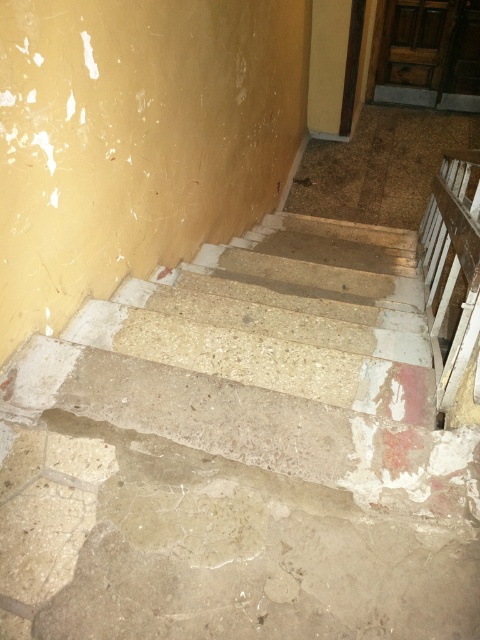
You are standing at the bottom of the worn staircase and want to reach the top. There are two points marked on the steps. One is at point (90, 381) and the other at point (462, 198). Which point should you step on first to start climbing the stairs?

You should step on point (90, 381) first because it is closer to you than point (462, 198), which is further away.

You are a delivery person carrying a large box that is 20 inches wide. You need to walk up the concrete stairs at center while avoiding the white wooden rail at right. Can you safely pass through the space between them?

The distance between the concrete stairs at center and the white wooden rail at right is 20.19 inches. Since your box is 20 inches wide, there is enough space to pass safely with a small margin of 0.19 inches.

You are a delivery person carrying a large box that is 2 meters wide. You need to navigate through the staircase area shown in the image. Can you pass through the space between the concrete stairs at center and the white wooden rail at right? Please explain your reasoning.

The concrete stairs at center might be wider than the white wooden rail at right. However, since the box is 2 meters wide and the exact width of the space between them isn not specified, it is uncertain whether the box will fit. You should measure the space before attempting to pass through.